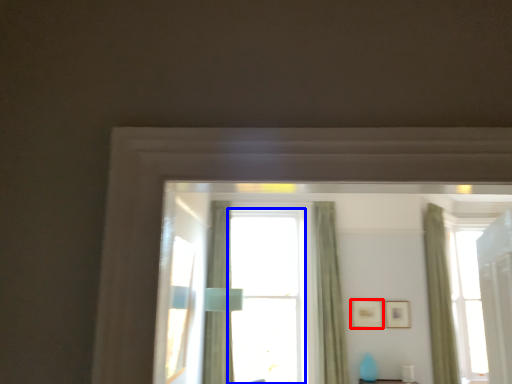
Question: Which of the following is the farthest to the observer, picture frame (highlighted by a red box) or window (highlighted by a blue box)?

Choices:
 (A) picture frame
 (B) window

Answer: (A)